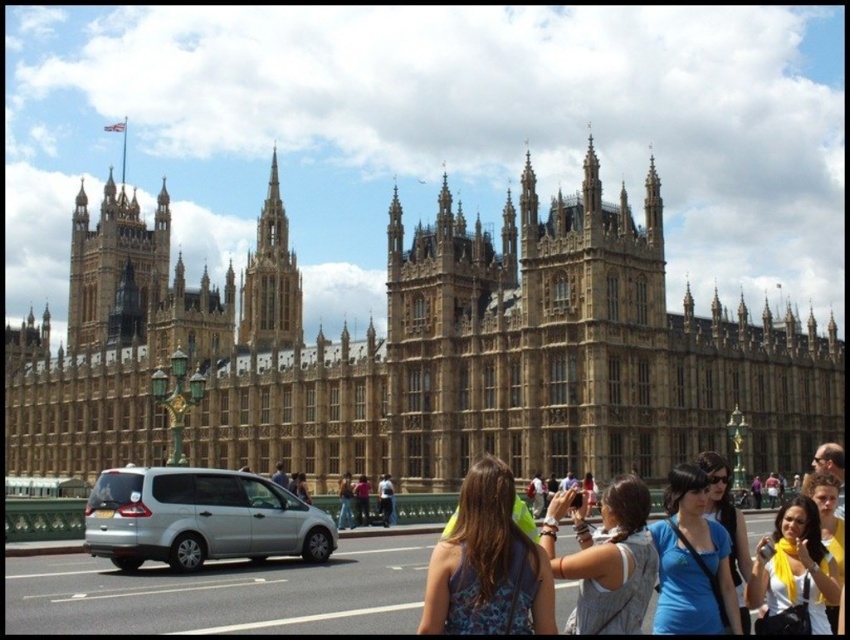
Question: Does blue cotton shirt at center appear over golden stone spire at center?

Choices:
 (A) yes
 (B) no

Answer: (B)

Question: Does neon yellow shirt at center have a smaller size compared to yellow scarf at center?

Choices:
 (A) yes
 (B) no

Answer: (A)

Question: Which is farther from the brown stone building at center?

Choices:
 (A) blue cotton shirt at center
 (B) neon yellow shirt at center

Answer: (B)

Question: Which object is closer to the camera taking this photo?

Choices:
 (A) yellow scarf at center
 (B) silver metallic van at center

Answer: (A)

Question: Which object is closer to the camera taking this photo?

Choices:
 (A) silver metallic van at center
 (B) neon yellow shirt at center
 (C) golden stone tower at upper left
 (D) yellow fabric scarf at lower right

Answer: (B)

Question: Does silver metallic van at center have a smaller size compared to neon yellow shirt at center?

Choices:
 (A) yes
 (B) no

Answer: (B)